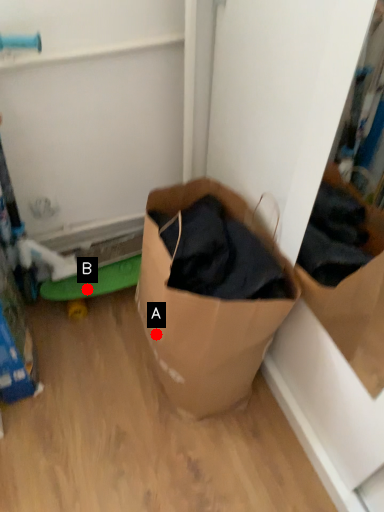
Question: Two points are circled on the image, labeled by A and B beside each circle. Among these points, which one is nearest to the camera?

Choices:
 (A) A is closer
 (B) B is closer

Answer: (A)